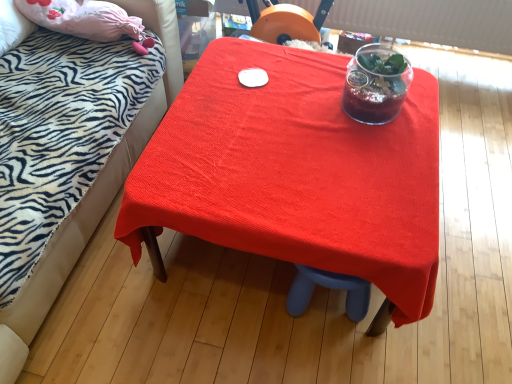
Question: From the image's perspective, is smooth red tablecloth at center located above translucent glass vase at upper center?

Choices:
 (A) yes
 (B) no

Answer: (B)

Question: Does smooth red tablecloth at center have a smaller size compared to translucent glass vase at upper center?

Choices:
 (A) yes
 (B) no

Answer: (B)

Question: Could you tell me if smooth red tablecloth at center is turned towards translucent glass vase at upper center?

Choices:
 (A) yes
 (B) no

Answer: (B)

Question: Is smooth red tablecloth at center to the left of translucent glass vase at upper center from the viewer's perspective?

Choices:
 (A) yes
 (B) no

Answer: (A)

Question: Is smooth red tablecloth at center looking in the opposite direction of translucent glass vase at upper center?

Choices:
 (A) yes
 (B) no

Answer: (B)

Question: Is smooth red tablecloth at center taller than translucent glass vase at upper center?

Choices:
 (A) yes
 (B) no

Answer: (A)

Question: Can you confirm if smooth red tablecloth at center is taller than zebra-patterned fabric bed at upper left?

Choices:
 (A) yes
 (B) no

Answer: (B)

Question: Is smooth red tablecloth at center to the right of zebra-patterned fabric bed at upper left from the viewer's perspective?

Choices:
 (A) no
 (B) yes

Answer: (B)

Question: Can you confirm if smooth red tablecloth at center is smaller than zebra-patterned fabric bed at upper left?

Choices:
 (A) yes
 (B) no

Answer: (A)

Question: Does smooth red tablecloth at center lie in front of zebra-patterned fabric bed at upper left?

Choices:
 (A) no
 (B) yes

Answer: (A)

Question: Can you confirm if smooth red tablecloth at center is positioned to the left of zebra-patterned fabric bed at upper left?

Choices:
 (A) no
 (B) yes

Answer: (A)

Question: Is smooth red tablecloth at center bigger than zebra-patterned fabric bed at upper left?

Choices:
 (A) no
 (B) yes

Answer: (A)

Question: Does translucent glass vase at upper center have a larger size compared to smooth red tablecloth at center?

Choices:
 (A) no
 (B) yes

Answer: (A)